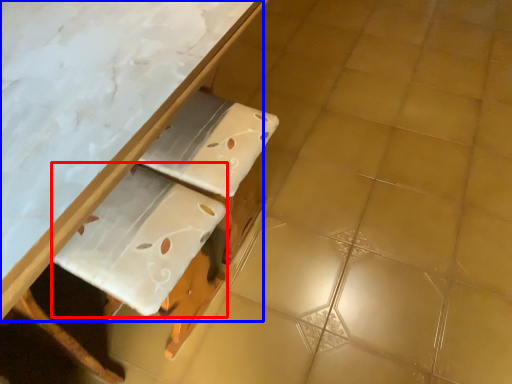
Question: Which object is closer to the camera taking this photo, cardboard (highlighted by a red box) or table (highlighted by a blue box)?

Choices:
 (A) cardboard
 (B) table

Answer: (B)